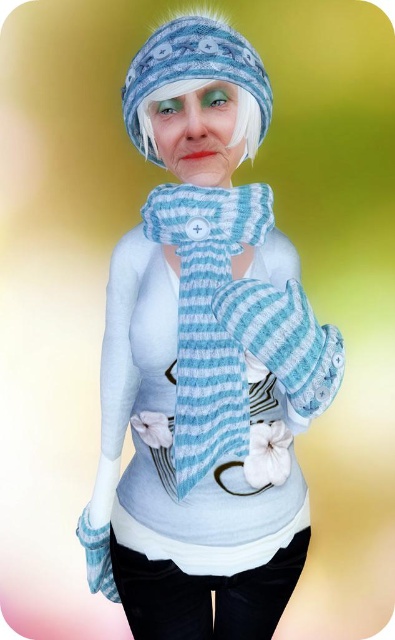
You are standing in front of the person wearing the blue and white striped hat and scarf. You notice two points marked on their outfit. The first point is at coordinates point (x=195, y=284) and the second is at point (x=148, y=131). From your perspective, which point is closer to you?

Point (x=195, y=284) is in front of point (x=148, y=131), so it is closer to you.

You are trying to decide which hat to wear from the image. Both the fuzzy woolen hat at upper center and the white fuzzy hat at upper center are options. Which one has a larger size?

The fuzzy woolen hat at upper center is bigger than the white fuzzy hat at upper center.

You are trying to decide which hat to wear for a winter event. You have two hats in the image. The fuzzy woolen hat at upper center and the white fuzzy hat at upper center. Which one is taller?

The fuzzy woolen hat at upper center is taller than the white fuzzy hat at upper center according to the description.